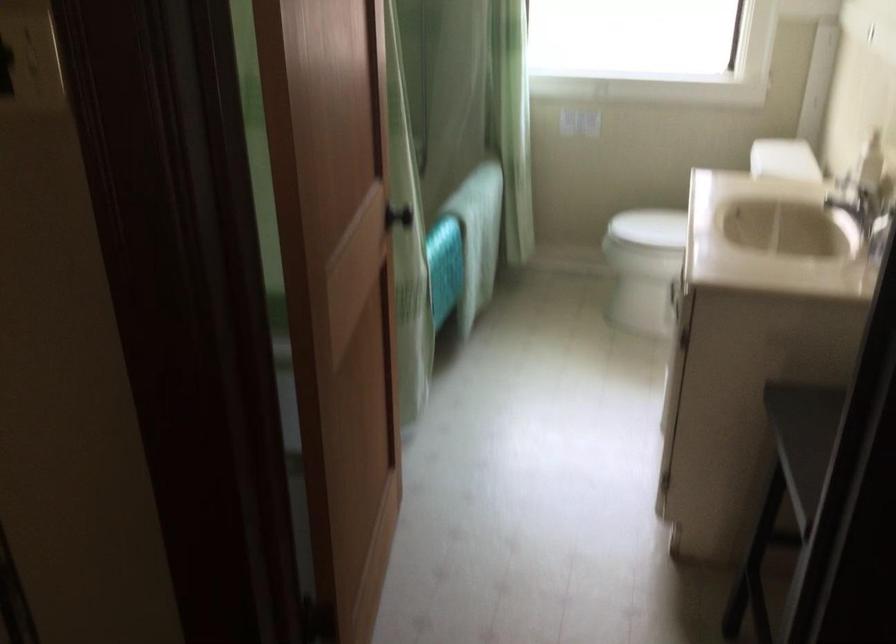
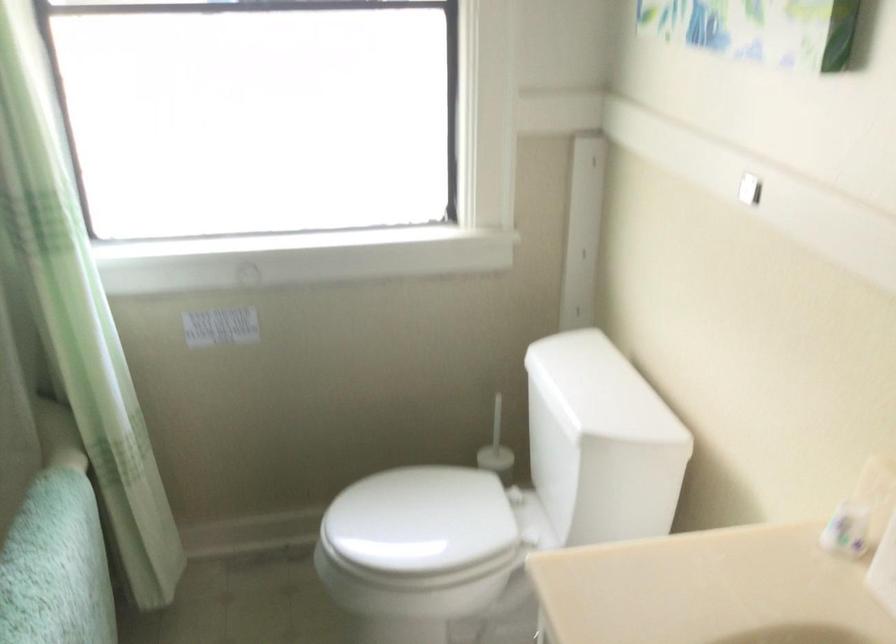
Locate, in the second image, the point that corresponds to [780,154] in the first image.

(599, 390)